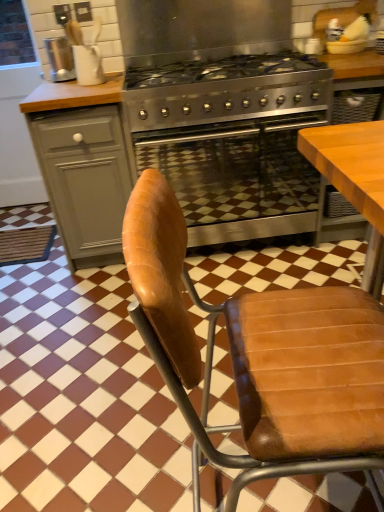
At what (x,y) coordinates should I click in order to perform the action: click on free space in front of white matte mug at upper left. Please return your answer as a coordinate pair (x, y). Looking at the image, I should click on (96, 87).